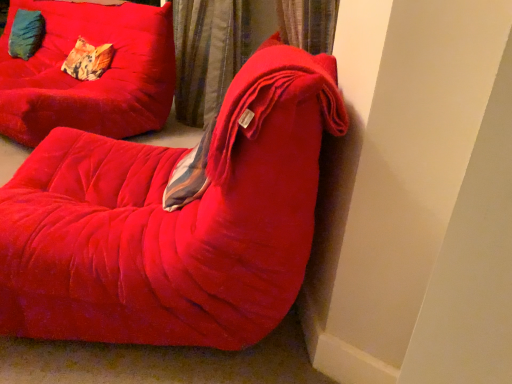
Question: Is velvet cushion at upper left, which is the 2th pillow in right-to-left order, spatially inside velvet curtain at upper center, or outside of it?

Choices:
 (A) outside
 (B) inside

Answer: (A)

Question: Does point (41, 24) appear closer or farther from the camera than point (199, 51)?

Choices:
 (A) closer
 (B) farther

Answer: (B)

Question: Which object is the closest to the velvet red chair at center, which is counted as the 2th furniture, starting from the back?

Choices:
 (A) patterned fabric pillow at upper left, the 2th pillow in the back-to-front sequence
 (B) velvet red couch at center, positioned as the second furniture in front-to-back order
 (C) velvet cushion at upper left, which is the 2th pillow in right-to-left order
 (D) velvet curtain at upper center

Answer: (B)

Question: Based on their relative distances, which object is farther from the velvet red chair at center, which is counted as the first furniture, starting from the front?

Choices:
 (A) velvet cushion at upper left, marked as the 1th pillow in a back-to-front arrangement
 (B) patterned fabric pillow at upper left, which appears as the 1th pillow when viewed from the right
 (C) velvet red couch at center, which is the first furniture in back-to-front order
 (D) velvet curtain at upper center

Answer: (A)